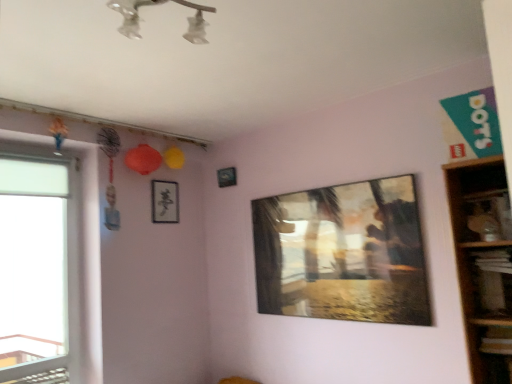
Question: Does wooden shelf at right have a lesser height compared to transparent glass window at left?

Choices:
 (A) yes
 (B) no

Answer: (A)

Question: Can you confirm if wooden shelf at right is positioned to the right of transparent glass window at left?

Choices:
 (A) no
 (B) yes

Answer: (B)

Question: Is wooden shelf at right further to camera compared to transparent glass window at left?

Choices:
 (A) no
 (B) yes

Answer: (A)

Question: Considering the relative sizes of wooden shelf at right and transparent glass window at left in the image provided, is wooden shelf at right bigger than transparent glass window at left?

Choices:
 (A) yes
 (B) no

Answer: (A)

Question: From the image's perspective, is wooden shelf at right over transparent glass window at left?

Choices:
 (A) no
 (B) yes

Answer: (B)

Question: From the image's perspective, is metallic rectangular frame at upper center, which ranks as the 3th picture frame in front-to-back order, positioned above or below black paper at upper center, arranged as the 2th picture frame when viewed from the front?

Choices:
 (A) above
 (B) below

Answer: (A)

Question: From a real-world perspective, relative to black paper at upper center, which appears as the first picture frame when viewed from the left, is metallic rectangular frame at upper center, which is the second picture frame from right to left, vertically above or below?

Choices:
 (A) below
 (B) above

Answer: (B)

Question: In terms of width, does metallic rectangular frame at upper center, which ranks as the 3th picture frame in front-to-back order, look wider or thinner when compared to black paper at upper center, the 3th picture frame when ordered from right to left?

Choices:
 (A) wide
 (B) thin

Answer: (B)

Question: Considering the positions of point (219, 183) and point (160, 205), is point (219, 183) closer or farther from the camera than point (160, 205)?

Choices:
 (A) farther
 (B) closer

Answer: (A)

Question: Considering the positions of metallic reflective painting at center, which is the third picture frame in back-to-front order, and metallic rectangular frame at upper center, which is the second picture frame in left-to-right order, in the image, is metallic reflective painting at center, which is the third picture frame in back-to-front order, bigger or smaller than metallic rectangular frame at upper center, which is the second picture frame in left-to-right order,?

Choices:
 (A) small
 (B) big

Answer: (B)

Question: From the image's perspective, is metallic reflective painting at center, which is the third picture frame in back-to-front order, located above or below metallic rectangular frame at upper center, which ranks as the 3th picture frame in front-to-back order?

Choices:
 (A) above
 (B) below

Answer: (B)

Question: Does point (407, 299) appear closer or farther from the camera than point (225, 185)?

Choices:
 (A) closer
 (B) farther

Answer: (A)

Question: Do you think metallic reflective painting at center, which is the first picture frame in right-to-left order, is within metallic rectangular frame at upper center, which is the second picture frame in left-to-right order, or outside of it?

Choices:
 (A) outside
 (B) inside

Answer: (A)

Question: From a real-world perspective, is metallic rectangular frame at upper center, which is the second picture frame in left-to-right order, above or below transparent glass window at left?

Choices:
 (A) below
 (B) above

Answer: (B)

Question: Is point (227, 173) closer or farther from the camera than point (27, 264)?

Choices:
 (A) closer
 (B) farther

Answer: (B)